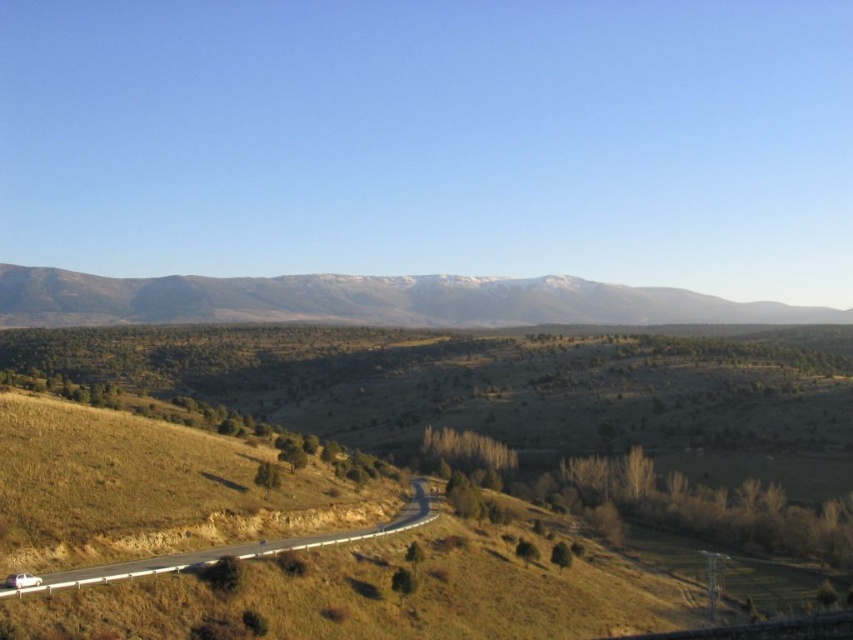
The height and width of the screenshot is (640, 853). What do you see at coordinates (370, 300) in the screenshot? I see `snowy rock mountain range at upper center` at bounding box center [370, 300].

Can you confirm if snowy rock mountain range at upper center is thinner than asphalt road at lower left?

Incorrect, snowy rock mountain range at upper center's width is not less than asphalt road at lower left's.

Does point (33, 272) come closer to viewer compared to point (167, 566)?

That is False.

Where is `snowy rock mountain range at upper center`? This screenshot has height=640, width=853. snowy rock mountain range at upper center is located at coordinates (370, 300).